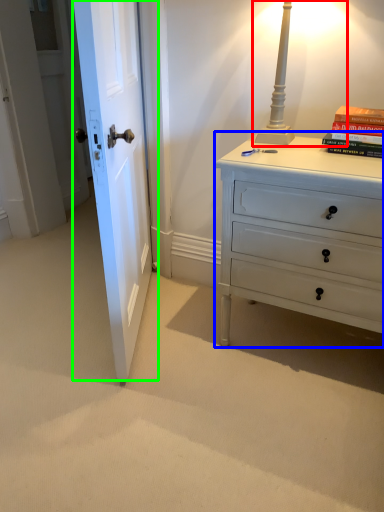
Question: Which is nearer to the table lamp (highlighted by a red box)? chest of drawers (highlighted by a blue box) or door (highlighted by a green box).

Choices:
 (A) chest of drawers
 (B) door

Answer: (A)